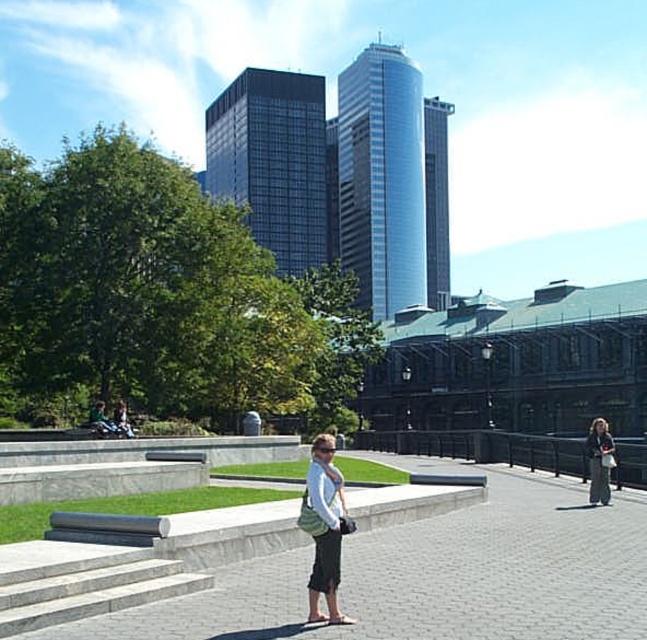
You are a photographer trying to capture a photo of the green fabric bag at center and the gray fabric pants at right. Which object should you focus on first if you want to ensure both are in the same frame?

The green fabric bag at center is above the gray fabric pants at right, so you should focus on the green fabric bag at center first to ensure both are in the same frame.

You are a photographer trying to capture the green fabric bag at center and the gray fabric pants at right in the same frame. Since you want to ensure both are clearly visible, which object should you focus on first to avoid blurring due to their size difference?

The green fabric bag at center is thinner than gray fabric pants at right, so you should focus on the gray fabric pants at right first because it is larger and might require more precise focusing to ensure clarity.

You are standing at the entrance of the park and see the gray concrete stairs at lower left and the gray fabric pants at right. Which object is located to the left of the other?

The gray concrete stairs at lower left is positioned on the left side of gray fabric pants at right.